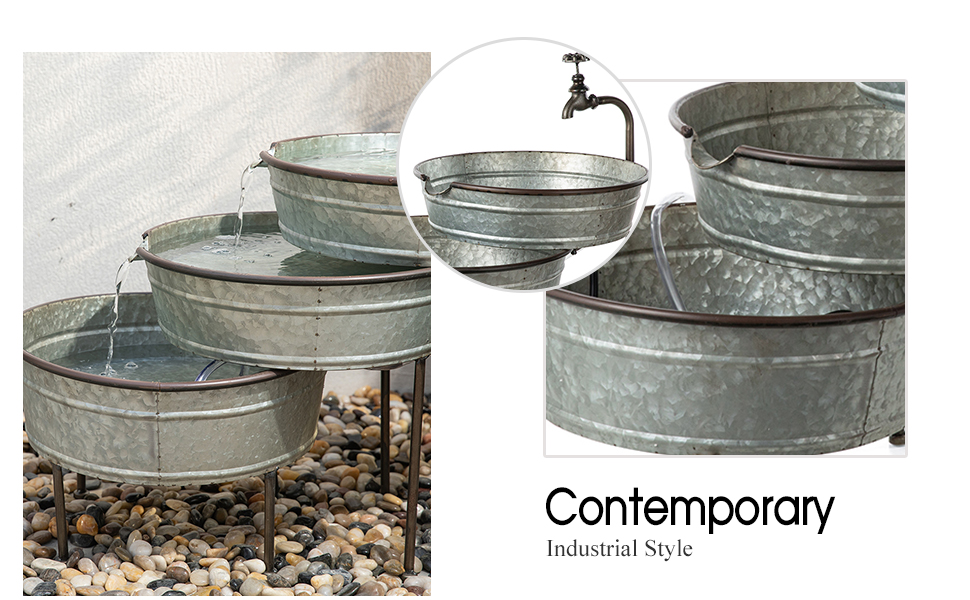
Where is `faucet`? faucet is located at coordinates point(574,56).